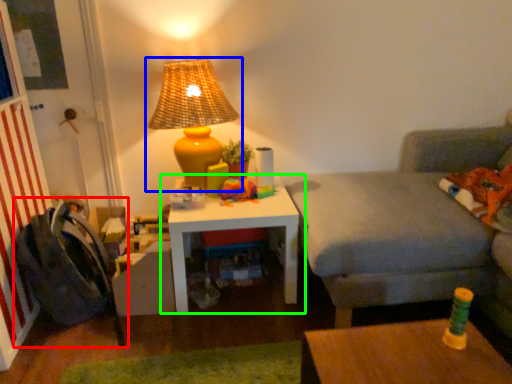
Question: Based on their relative distances, which object is nearer to swivel chair (highlighted by a red box)? Choose from lamp (highlighted by a blue box) and table (highlighted by a green box).

Choices:
 (A) lamp
 (B) table

Answer: (B)